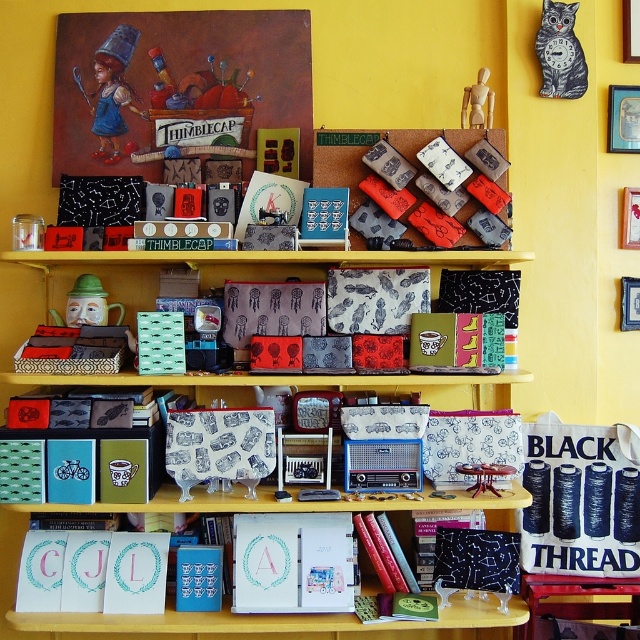
Is point (493, 250) in front of point (632, 284)?

Yes.

From the picture: Which of these two, matte black boxes at center or metallic silver picture frame at upper right, stands shorter?

metallic silver picture frame at upper right is shorter.

Find the location of a particular element. The height and width of the screenshot is (640, 640). matte black boxes at center is located at coordinates (230, 266).

Where is `matte black boxes at center`? This screenshot has height=640, width=640. matte black boxes at center is located at coordinates (230, 266).

Between matte black boxes at center and patterned fabric boxes at center, which one is positioned higher?

patterned fabric boxes at center is above.

The width and height of the screenshot is (640, 640). In order to click on matte black boxes at center in this screenshot , I will do `click(230, 266)`.

Between wooden picture frame at upper right and metallic silver picture frame at upper right, which one appears on the right side from the viewer's perspective?

Positioned to the right is metallic silver picture frame at upper right.

Consider the image. Who is more forward, (634,220) or (625,310)?

Point (625,310) is in front.

Image resolution: width=640 pixels, height=640 pixels. What do you see at coordinates (630, 218) in the screenshot? I see `wooden picture frame at upper right` at bounding box center [630, 218].

Where is `wooden picture frame at upper right`? The image size is (640, 640). wooden picture frame at upper right is located at coordinates (630, 218).